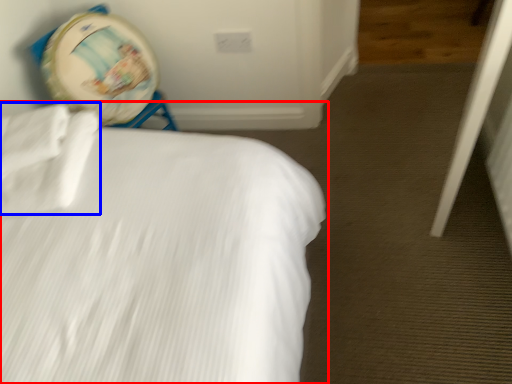
Question: Which object appears farthest to the camera in this image, bed (highlighted by a red box) or sheet (highlighted by a blue box)?

Choices:
 (A) bed
 (B) sheet

Answer: (B)